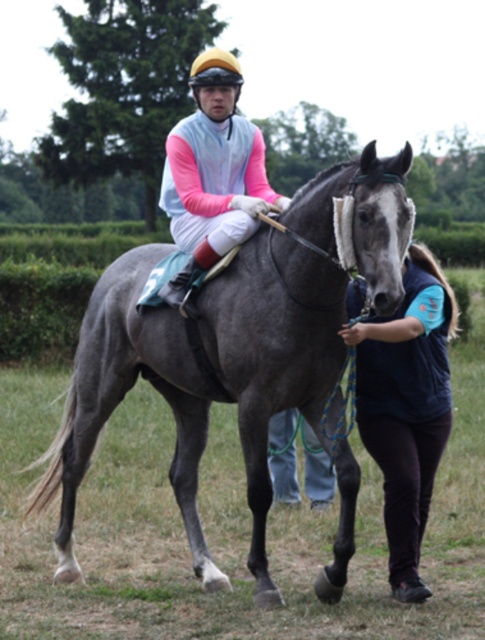
You are a photographer positioned to the left of the gray glossy horse at center. You want to take a photo of the dark blue fleece vest at lower right. Which direction should you move to capture the vest in your shot?

You should move to your right to capture the dark blue fleece vest at lower right in your shot since the gray glossy horse at center is to the left of the dark blue fleece vest at lower right.

You are a photographer standing at a safe distance from the gray glossy horse at center. You want to take a closeup photo of the horse without getting too close. Your camera has a zoom lens that can focus up to 4 meters. Can you capture a clear closeup of the horse?

The gray glossy horse at center is 4.54 meters away from the viewer. Since the camera can focus up to 4 meters, it cannot capture a clear closeup as the horse is slightly farther away than the maximum focusing distance.

You are a photographer standing in front of the scene. You want to take a photo of the dark blue fleece vest at lower right. Where should you point your camera?

You should point your camera at point (406, 406) to capture the dark blue fleece vest at lower right.